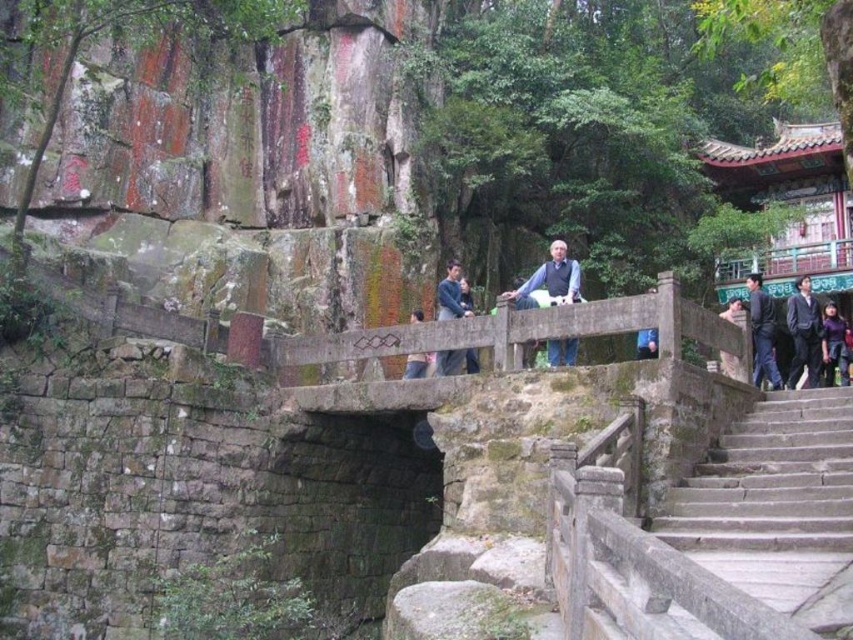
You are standing at the entrance of the stone bridge and see the light blue denim jacket at center. If you walk straight ahead, will the jacket be in your path?

The light blue denim jacket at center is located at point 2D coordinates of (550, 280). Since you are at the entrance of the stone bridge, walking straight ahead would likely lead you towards the center area where the jacket is placed, so yes, it would be in your path.

You are standing at the stone bridge with wooden railings in the foreground of the historical site. You see two points marked on the ground ahead of you. One is labeled as point (x=479, y=340) and the other as point (x=409, y=371). Which of these two points is closer to you as you stand on the bridge?

Point (x=479, y=340) is closer to you because it is in front of point (x=409, y=371).